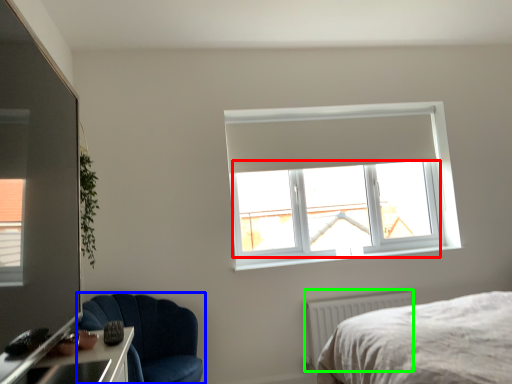
Question: Considering the real-world distances, which object is farthest from window screen (highlighted by a red box)? chair (highlighted by a blue box) or radiator (highlighted by a green box)?

Choices:
 (A) chair
 (B) radiator

Answer: (A)